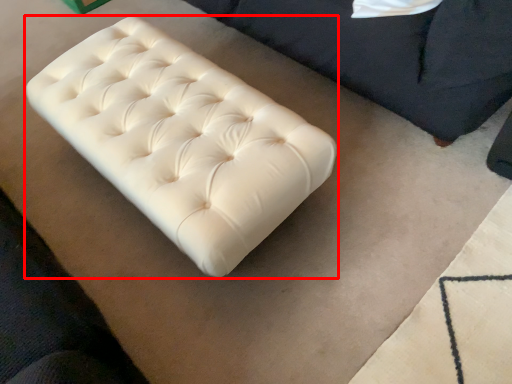
Question: In this image, where is furniture (annotated by the red box) located relative to furniture?

Choices:
 (A) left
 (B) right

Answer: (A)